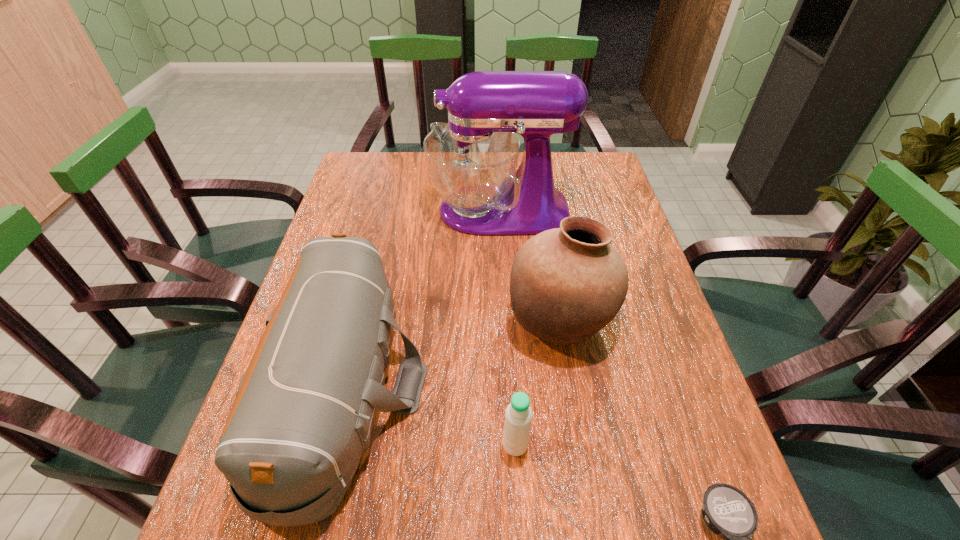
Identify the location of the tallest object. Image resolution: width=960 pixels, height=540 pixels. (472, 161).

Locate an element on the screen. This screenshot has height=540, width=960. the farthest object is located at coordinates (472, 161).

You are a GUI agent. You are given a task and a screenshot of the screen. Output one action in this format:
    pyautogui.click(x=<x>, y=<y>)
    Task: Click on the fourth shortest object
    This screenshot has width=960, height=540.
    Given the screenshot: What is the action you would take?
    pyautogui.click(x=566, y=284)

Identify the location of the third shortest object. The width and height of the screenshot is (960, 540). (303, 414).

Find the location of a particular element. water bottle is located at coordinates (518, 415).

At what (x,y) coordinates should I click in order to perform the action: click on free point located at the bowl opening of the tallest object. Please return your answer as a coordinate pair (x, y). This screenshot has height=540, width=960. Looking at the image, I should click on (x=376, y=211).

In order to click on free spot located 0.090m at the bowl opening of the tallest object in this screenshot , I will do `click(399, 211)`.

Identify the location of vacant region located 0.240m at the bowl opening of the tallest object. This screenshot has width=960, height=540. coord(349,211).

What are the coordinates of `vacant space located 0.080m on the left of the pottery` in the screenshot? It's located at (473, 320).

The width and height of the screenshot is (960, 540). Identify the location of vacant space located 0.230m on the right of the third shortest object. (539, 388).